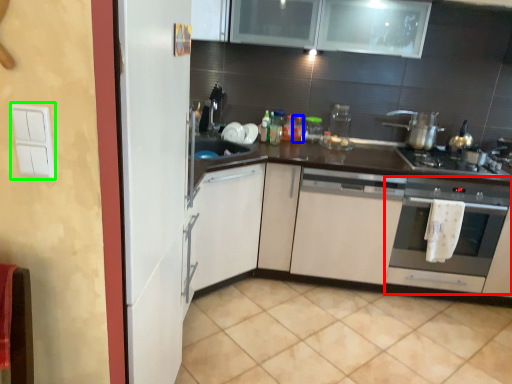
Question: Estimate the real-world distances between objects in this image. Which object is closer to oven (highlighted by a red box), bottle (highlighted by a blue box) or light switch (highlighted by a green box)?

Choices:
 (A) bottle
 (B) light switch

Answer: (A)